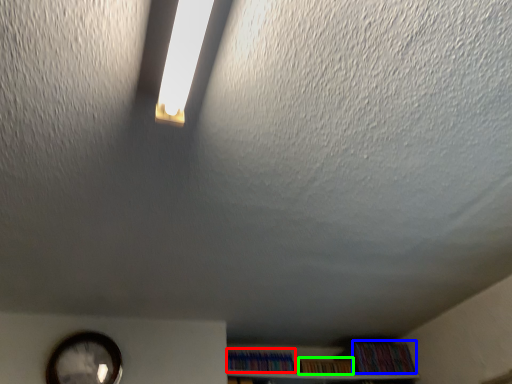
Question: Considering the real-world distances, which object is farthest from book (highlighted by a red box)? book (highlighted by a blue box) or book (highlighted by a green box)?

Choices:
 (A) book
 (B) book

Answer: (A)